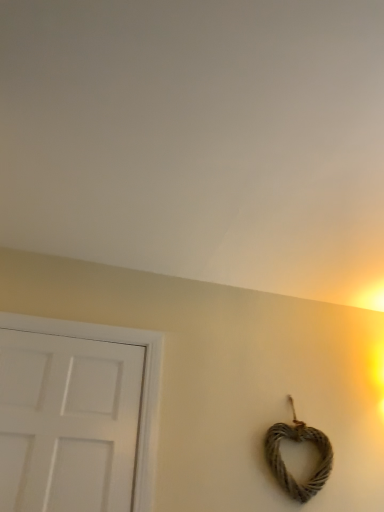
Question: From a real-world perspective, relative to white matte door at left, is rustic brown rope heart at lower right vertically above or below?

Choices:
 (A) above
 (B) below

Answer: (B)

Question: From the image's perspective, is rustic brown rope heart at lower right positioned above or below white matte door at left?

Choices:
 (A) above
 (B) below

Answer: (B)

Question: Looking at their shapes, would you say rustic brown rope heart at lower right is wider or thinner than white matte door at left?

Choices:
 (A) thin
 (B) wide

Answer: (A)

Question: Choose the correct answer: Is white matte door at left inside rustic brown rope heart at lower right or outside it?

Choices:
 (A) inside
 (B) outside

Answer: (B)

Question: Would you say white matte door at left is to the left or to the right of rustic brown rope heart at lower right in the picture?

Choices:
 (A) right
 (B) left

Answer: (B)

Question: Based on their sizes in the image, would you say white matte door at left is bigger or smaller than rustic brown rope heart at lower right?

Choices:
 (A) big
 (B) small

Answer: (A)

Question: From a real-world perspective, relative to rustic brown rope heart at lower right, is white matte door at left vertically above or below?

Choices:
 (A) below
 (B) above

Answer: (B)